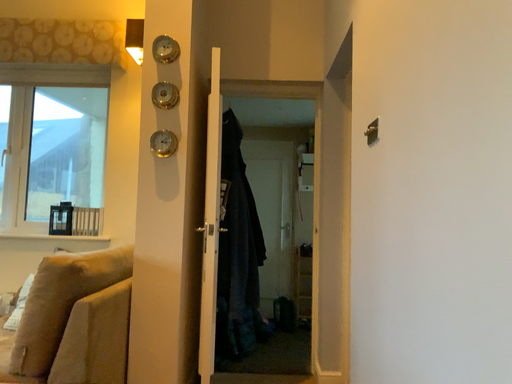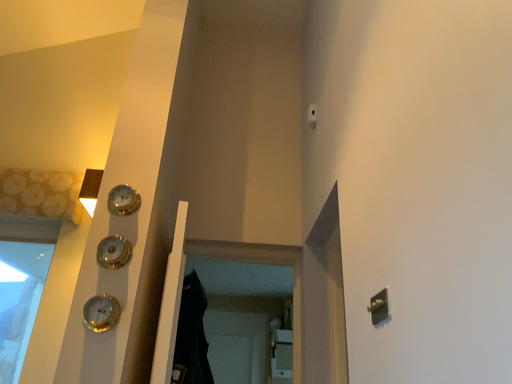
Question: Which way did the camera rotate in the video?

Choices:
 (A) rotated upward
 (B) rotated downward

Answer: (A)